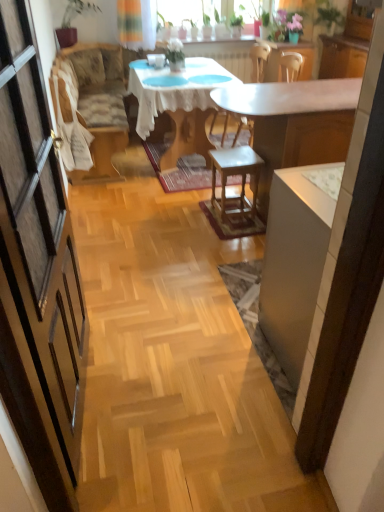
Question: Can you confirm if white glossy desk at center is taller than white glossy cabinet at right?

Choices:
 (A) no
 (B) yes

Answer: (B)

Question: Would you say white glossy desk at center contains white glossy cabinet at right?

Choices:
 (A) yes
 (B) no

Answer: (B)

Question: From a real-world perspective, is white glossy desk at center on white glossy cabinet at right?

Choices:
 (A) no
 (B) yes

Answer: (B)

Question: Does white glossy desk at center have a lesser width compared to white glossy cabinet at right?

Choices:
 (A) yes
 (B) no

Answer: (B)

Question: Is white glossy desk at center to the left of white glossy cabinet at right from the viewer's perspective?

Choices:
 (A) no
 (B) yes

Answer: (A)

Question: Is white glossy cabinet at right bigger or smaller than white lace tablecloth at center?

Choices:
 (A) small
 (B) big

Answer: (A)

Question: Is white glossy cabinet at right wider or thinner than white lace tablecloth at center?

Choices:
 (A) wide
 (B) thin

Answer: (B)

Question: In terms of height, does white glossy cabinet at right look taller or shorter compared to white lace tablecloth at center?

Choices:
 (A) short
 (B) tall

Answer: (B)

Question: From a real-world perspective, is white glossy cabinet at right above or below white lace tablecloth at center?

Choices:
 (A) above
 (B) below

Answer: (B)

Question: Is white glossy desk at center in front of or behind wooden stool at center in the image?

Choices:
 (A) front
 (B) behind

Answer: (A)

Question: Is white glossy desk at center to the left or to the right of wooden stool at center in the image?

Choices:
 (A) left
 (B) right

Answer: (B)

Question: Is point (238, 105) closer or farther from the camera than point (226, 216)?

Choices:
 (A) closer
 (B) farther

Answer: (A)

Question: From their relative heights in the image, would you say white glossy desk at center is taller or shorter than wooden stool at center?

Choices:
 (A) short
 (B) tall

Answer: (B)

Question: In terms of size, does patterned fabric couch at left appear bigger or smaller than wooden stool at center?

Choices:
 (A) small
 (B) big

Answer: (B)

Question: Considering their positions, is patterned fabric couch at left located in front of or behind wooden stool at center?

Choices:
 (A) behind
 (B) front

Answer: (A)